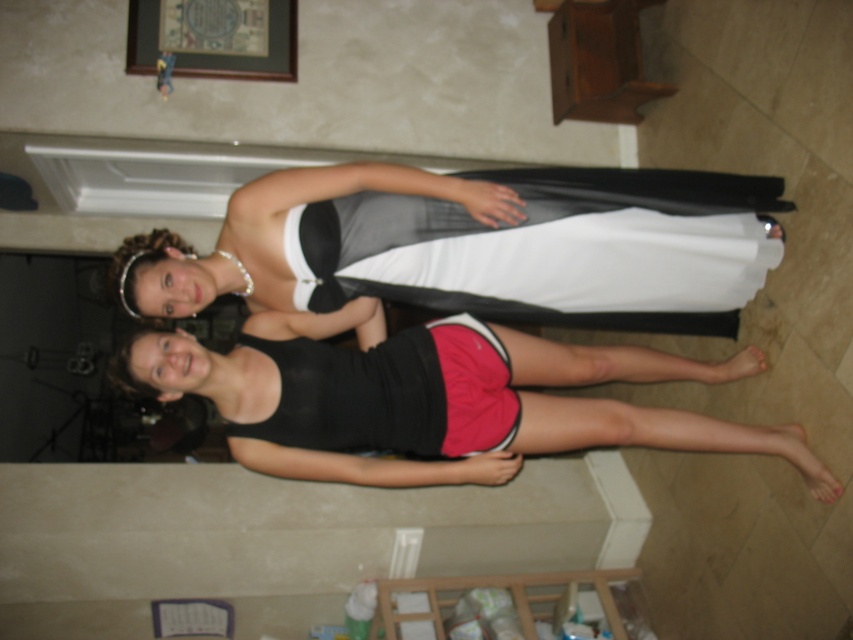
Based on the photo, between matte black dress at center and black matte shorts at lower center, which one has more height?

With more height is black matte shorts at lower center.

Consider the image. Does matte black dress at center have a greater height compared to black matte shorts at lower center?

No.

This screenshot has width=853, height=640. What do you see at coordinates (479, 246) in the screenshot? I see `matte black dress at center` at bounding box center [479, 246].

This screenshot has height=640, width=853. Identify the location of matte black dress at center. (479, 246).